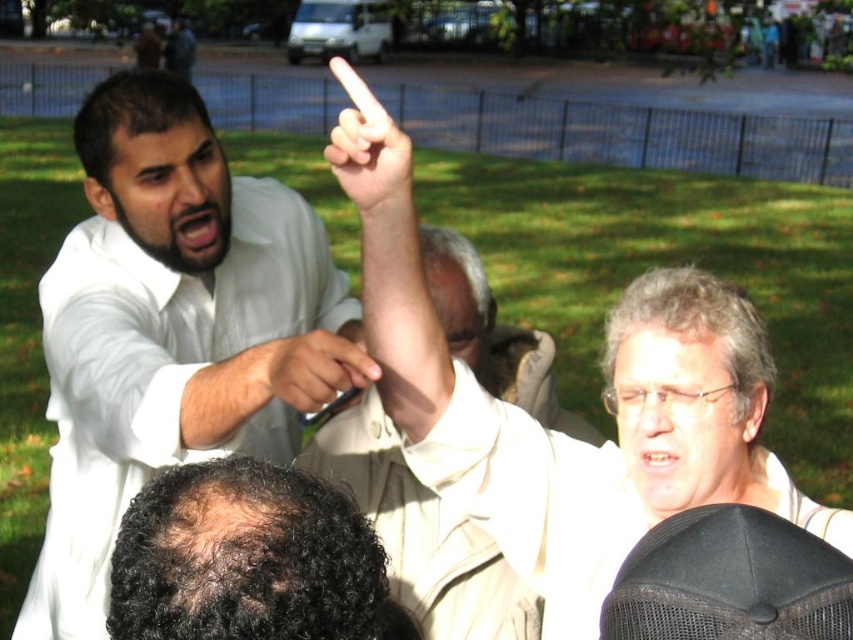
Does white matte shirt at upper left have a lesser width compared to matte black pen at upper center?

Incorrect, white matte shirt at upper left's width is not less than matte black pen at upper center's.

This screenshot has width=853, height=640. Find the location of `white matte shirt at upper left`. white matte shirt at upper left is located at coordinates (161, 326).

Who is positioned more to the left, white matte shirt at upper left or smooth skin finger at upper center?

From the viewer's perspective, white matte shirt at upper left appears more on the left side.

Locate an element on the screen. The width and height of the screenshot is (853, 640). white matte shirt at upper left is located at coordinates (161, 326).

Which of these two, smooth skin finger at upper center or matte black pen at upper center, stands taller?

With more height is smooth skin finger at upper center.

Is smooth skin finger at upper center smaller than matte black pen at upper center?

No.

Identify the location of smooth skin finger at upper center. The image size is (853, 640). (368, 148).

You are a GUI agent. You are given a task and a screenshot of the screen. Output one action in this format:
    pyautogui.click(x=<x>, y=<y>)
    Task: Click on the smooth skin finger at upper center
    This screenshot has width=853, height=640.
    Given the screenshot: What is the action you would take?
    pyautogui.click(x=368, y=148)